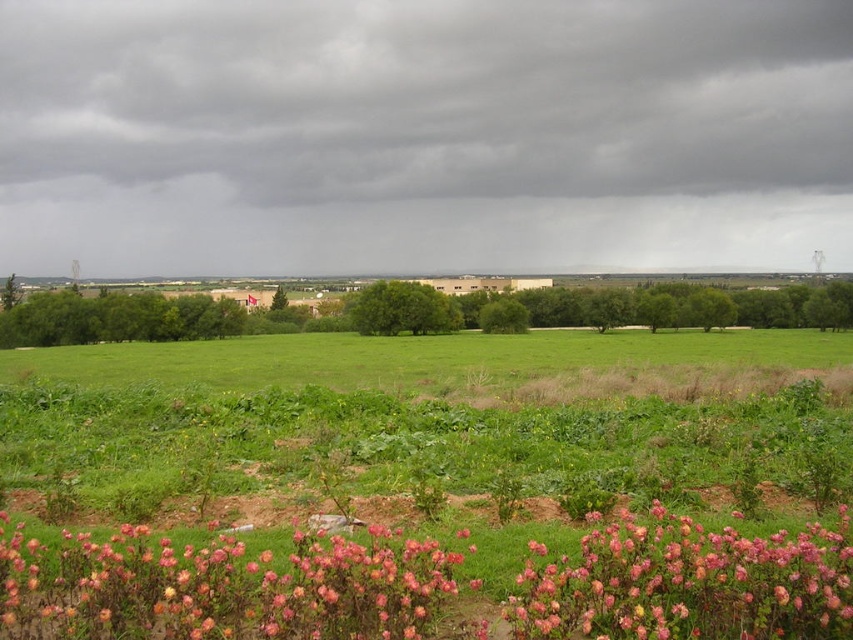
You are standing in a rural area and see the pink matte flowers at lower center and the green grassy field at center. Which object is located to the left of the other?

The pink matte flowers at lower center is positioned on the left side of green grassy field at center.